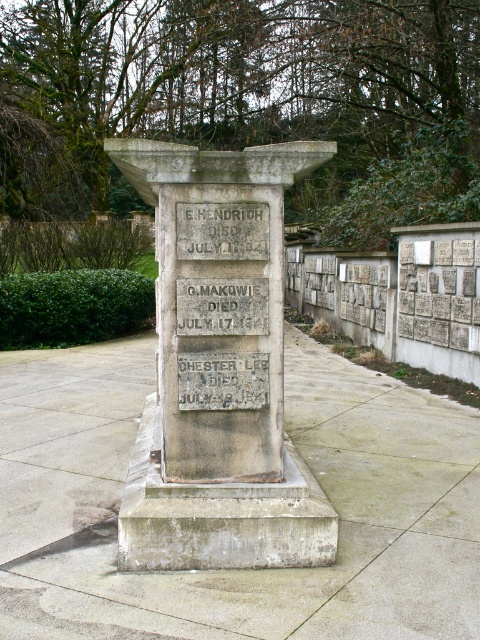
Can you confirm if gray stone monument at center is thinner than white stone plaque at center?

In fact, gray stone monument at center might be wider than white stone plaque at center.

Does gray stone monument at center appear on the left side of white stone plaque at center?

Yes, gray stone monument at center is to the left of white stone plaque at center.

Where is `gray stone monument at center`? The width and height of the screenshot is (480, 640). gray stone monument at center is located at coordinates (218, 369).